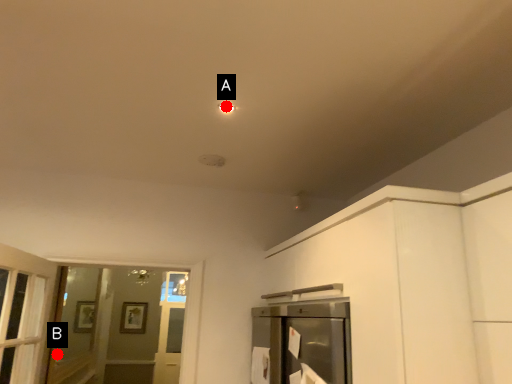
Question: Two points are circled on the image, labeled by A and B beside each circle. Which point is closer to the camera?

Choices:
 (A) A is closer
 (B) B is closer

Answer: (A)